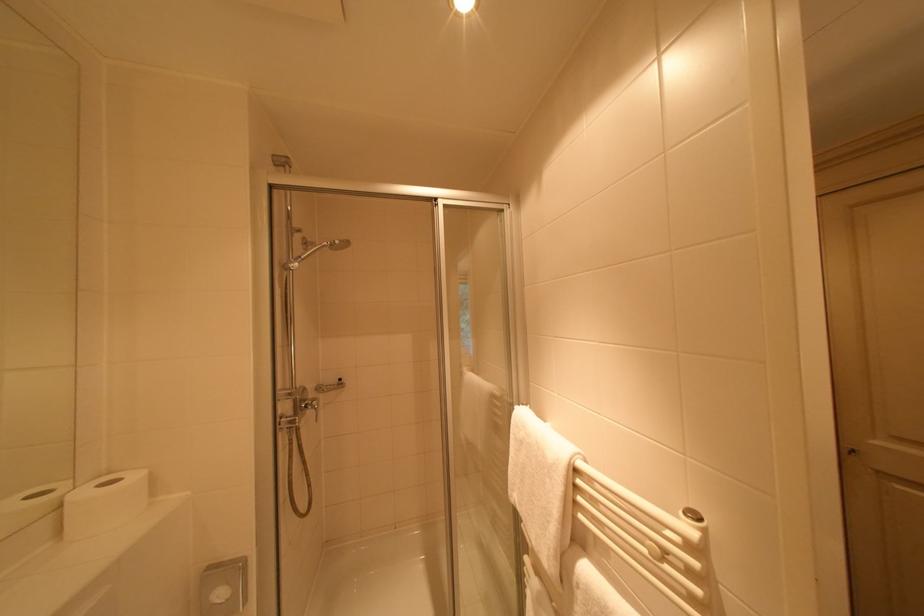
The height and width of the screenshot is (616, 924). What do you see at coordinates (103, 504) in the screenshot? I see `a white toilet paper` at bounding box center [103, 504].